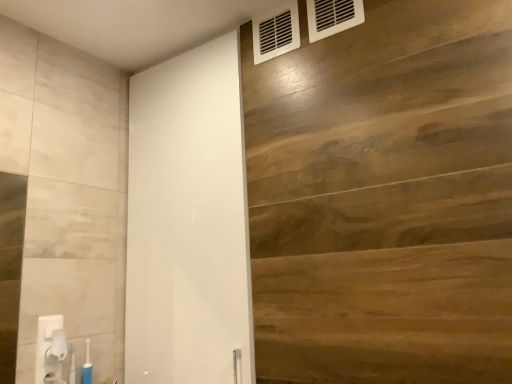
Locate an element on the screen. wooden panel at upper right is located at coordinates (384, 197).

Describe the element at coordinates (188, 222) in the screenshot. I see `white glossy barn door at center` at that location.

In order to face white plastic vent at upper right, which is the 2th air conditioning from front to back, should I rotate leftwards or rightwards?

You should rotate right by 3.046 degrees.

The height and width of the screenshot is (384, 512). What do you see at coordinates (58, 345) in the screenshot? I see `white plastic towel bar at lower left` at bounding box center [58, 345].

The height and width of the screenshot is (384, 512). Find the location of `white plastic air conditioning at upper right, which is counted as the 2th air conditioning, starting from the back`. white plastic air conditioning at upper right, which is counted as the 2th air conditioning, starting from the back is located at coordinates (332, 17).

Is white plastic vent at upper right, which is the 2th air conditioning from front to back, thinner than white plastic air conditioning at upper right, the first air conditioning positioned from the right?

No, white plastic vent at upper right, which is the 2th air conditioning from front to back, is not thinner than white plastic air conditioning at upper right, the first air conditioning positioned from the right.

What's the angular difference between white plastic vent at upper right, the 2th air conditioning viewed from the right, and white plastic air conditioning at upper right, the first air conditioning positioned from the right,'s facing directions?

The angular difference between white plastic vent at upper right, the 2th air conditioning viewed from the right, and white plastic air conditioning at upper right, the first air conditioning positioned from the right, is 0.00037 degrees.

In the image, is white plastic vent at upper right, placed as the 1th air conditioning when sorted from left to right, on the left side or the right side of white plastic air conditioning at upper right, which is counted as the 2th air conditioning, starting from the back?

In the image, white plastic vent at upper right, placed as the 1th air conditioning when sorted from left to right, appears on the left side of white plastic air conditioning at upper right, which is counted as the 2th air conditioning, starting from the back.

Is white plastic vent at upper right, the 1th air conditioning when ordered from back to front, behind white plastic air conditioning at upper right, acting as the 2th air conditioning starting from the left?

Yes.

Considering the relative positions of white plastic air conditioning at upper right, acting as the 2th air conditioning starting from the left, and wooden panel at upper right in the image provided, is white plastic air conditioning at upper right, acting as the 2th air conditioning starting from the left, in front of wooden panel at upper right?

No, it is behind wooden panel at upper right.

Is white plastic air conditioning at upper right, which appears as the first air conditioning when viewed from the front, bigger or smaller than wooden panel at upper right?

Clearly, white plastic air conditioning at upper right, which appears as the first air conditioning when viewed from the front, is smaller in size than wooden panel at upper right.

Could you tell me if white plastic air conditioning at upper right, which is counted as the 2th air conditioning, starting from the back, is turned towards wooden panel at upper right?

Yes, white plastic air conditioning at upper right, which is counted as the 2th air conditioning, starting from the back, is oriented towards wooden panel at upper right.

Is wooden panel at upper right completely or partially inside white plastic air conditioning at upper right, which is counted as the 2th air conditioning, starting from the back?

No, white plastic air conditioning at upper right, which is counted as the 2th air conditioning, starting from the back, does not contain wooden panel at upper right.

Is white plastic air conditioning at upper right, the first air conditioning positioned from the right, looking in the opposite direction of white glossy barn door at center?

white plastic air conditioning at upper right, the first air conditioning positioned from the right, does not have its back to white glossy barn door at center.

From the picture: Which is closer to the camera, (336, 14) or (196, 48)?

Point (336, 14).

Is white plastic air conditioning at upper right, which is counted as the 2th air conditioning, starting from the back, far from white glossy barn door at center?

No, there isn't a large distance between white plastic air conditioning at upper right, which is counted as the 2th air conditioning, starting from the back, and white glossy barn door at center.

Is white plastic air conditioning at upper right, acting as the 2th air conditioning starting from the left, further to the viewer compared to white glossy barn door at center?

That is True.

Is white glossy barn door at center positioned far away from translucent plastic toothbrush at lower left?

No, white glossy barn door at center is not far away from translucent plastic toothbrush at lower left.

Is translucent plastic toothbrush at lower left inside white glossy barn door at center?

No, translucent plastic toothbrush at lower left is not surrounded by white glossy barn door at center.

Considering the positions of point (132, 217) and point (73, 380), is point (132, 217) closer or farther from the camera than point (73, 380)?

Point (132, 217).

Where is `barn door above the translucent plastic toothbrush at lower left (from a real-world perspective)`? This screenshot has width=512, height=384. barn door above the translucent plastic toothbrush at lower left (from a real-world perspective) is located at coordinates (188, 222).

Consider the image. Is white glossy barn door at center facing towards wooden panel at upper right?

No, white glossy barn door at center is not oriented towards wooden panel at upper right.

Which object is closer to the camera, white glossy barn door at center or wooden panel at upper right?

wooden panel at upper right is closer to the camera.

Can we say white glossy barn door at center lies outside wooden panel at upper right?

Yes.

Is point (170, 351) closer to camera compared to point (389, 4)?

No.

Considering the positions of objects white plastic air conditioning at upper right, the first air conditioning positioned from the right, and blue plastic toothbrush at lower left in the image provided, who is more to the right, white plastic air conditioning at upper right, the first air conditioning positioned from the right, or blue plastic toothbrush at lower left?

white plastic air conditioning at upper right, the first air conditioning positioned from the right, is more to the right.

From a real-world perspective, between white plastic air conditioning at upper right, the first air conditioning positioned from the right, and blue plastic toothbrush at lower left, who is vertically higher?

white plastic air conditioning at upper right, the first air conditioning positioned from the right.

Does white plastic air conditioning at upper right, which is counted as the 2th air conditioning, starting from the back, turn towards blue plastic toothbrush at lower left?

No, white plastic air conditioning at upper right, which is counted as the 2th air conditioning, starting from the back, is not facing towards blue plastic toothbrush at lower left.

Based on the photo, from a real-world perspective, is blue plastic toothbrush at lower left over white plastic vent at upper right, the 2th air conditioning viewed from the right?

Incorrect, from a real-world perspective, blue plastic toothbrush at lower left is lower than white plastic vent at upper right, the 2th air conditioning viewed from the right.

Is blue plastic toothbrush at lower left bigger or smaller than white plastic vent at upper right, which is the 2th air conditioning from front to back?

Clearly, blue plastic toothbrush at lower left is smaller in size than white plastic vent at upper right, which is the 2th air conditioning from front to back.

Is blue plastic toothbrush at lower left oriented towards white plastic vent at upper right, the 1th air conditioning when ordered from back to front?

No, blue plastic toothbrush at lower left is not facing towards white plastic vent at upper right, the 1th air conditioning when ordered from back to front.

Identify the location of air conditioning that appears above the white plastic vent at upper right, placed as the 1th air conditioning when sorted from left to right (from the image's perspective). The image size is (512, 384). (332, 17).

Starting from the wooden panel at upper right, which air conditioning is the 1st one to the left? Please provide its 2D coordinates.

[(332, 17)]

When comparing their distances from white glossy barn door at center, does white plastic vent at upper right, placed as the 1th air conditioning when sorted from left to right, or wooden panel at upper right seem further?

white plastic vent at upper right, placed as the 1th air conditioning when sorted from left to right, lies further to white glossy barn door at center than the other object.

Which object lies nearer to the anchor point translucent plastic toothbrush at lower left, white plastic towel bar at lower left or wooden panel at upper right?

Among the two, white plastic towel bar at lower left is located nearer to translucent plastic toothbrush at lower left.

Based on their spatial positions, is translucent plastic toothbrush at lower left or wooden panel at upper right further from white plastic towel bar at lower left?

The object further to white plastic towel bar at lower left is wooden panel at upper right.

Looking at the image, which one is located further to white plastic air conditioning at upper right, the first air conditioning positioned from the right, white glossy barn door at center or wooden panel at upper right?

Among the two, white glossy barn door at center is located further to white plastic air conditioning at upper right, the first air conditioning positioned from the right.

Which object lies further to the anchor point blue plastic toothbrush at lower left, wooden panel at upper right or white plastic air conditioning at upper right, acting as the 2th air conditioning starting from the left?

white plastic air conditioning at upper right, acting as the 2th air conditioning starting from the left.

From the picture: When comparing their distances from blue plastic toothbrush at lower left, does wooden panel at upper right or translucent plastic toothbrush at lower left seem further?

wooden panel at upper right.

Estimate the real-world distances between objects in this image. Which object is closer to blue plastic toothbrush at lower left, translucent plastic toothbrush at lower left or white plastic vent at upper right, the 1th air conditioning when ordered from back to front?

The object closer to blue plastic toothbrush at lower left is translucent plastic toothbrush at lower left.

Looking at the image, which one is located further to white plastic air conditioning at upper right, acting as the 2th air conditioning starting from the left, blue plastic toothbrush at lower left or white plastic vent at upper right, placed as the 1th air conditioning when sorted from left to right?

blue plastic toothbrush at lower left lies further to white plastic air conditioning at upper right, acting as the 2th air conditioning starting from the left, than the other object.

At what (x,y) coordinates should I click in order to perform the action: click on soap dispenser between translucent plastic toothbrush at lower left and wooden panel at upper right in the horizontal direction. Please return your answer as a coordinate pair (x, y). The height and width of the screenshot is (384, 512). Looking at the image, I should click on (87, 366).

At what (x,y) coordinates should I click in order to perform the action: click on toiletry between white plastic towel bar at lower left and wooden panel at upper right in the horizontal direction. Please return your answer as a coordinate pair (x, y). Looking at the image, I should click on (72, 364).

Image resolution: width=512 pixels, height=384 pixels. Identify the location of towel bar between white glossy barn door at center and blue plastic toothbrush at lower left in the vertical direction. (58, 345).

Locate an element on the screen. Image resolution: width=512 pixels, height=384 pixels. towel bar between white plastic vent at upper right, the 1th air conditioning when ordered from back to front, and blue plastic toothbrush at lower left from top to bottom is located at coordinates (58, 345).